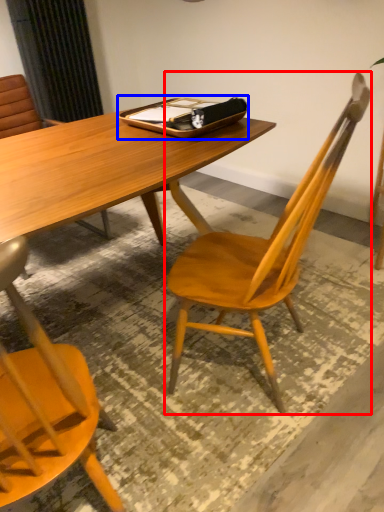
Question: Among these objects, which one is nearest to the camera, chair (highlighted by a red box) or tray (highlighted by a blue box)?

Choices:
 (A) chair
 (B) tray

Answer: (A)